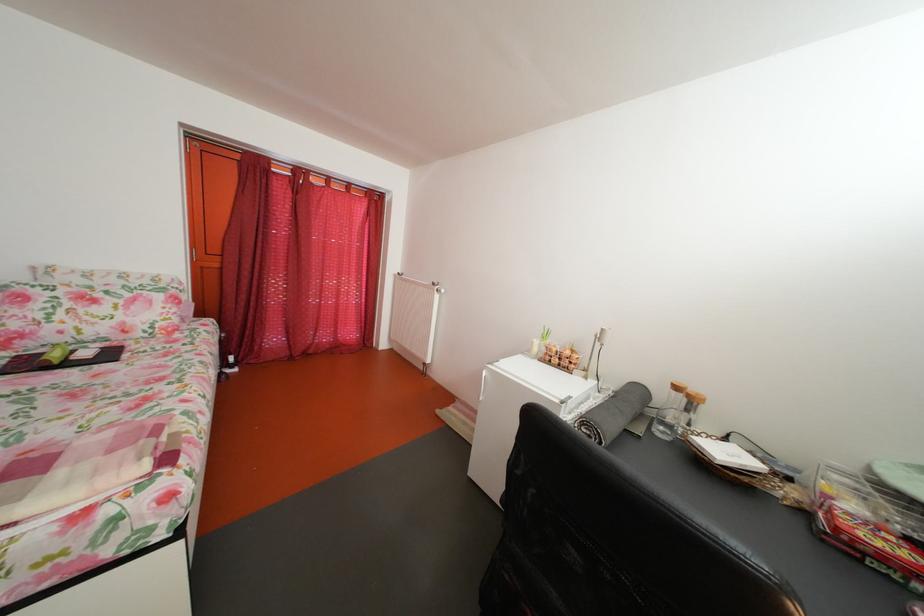
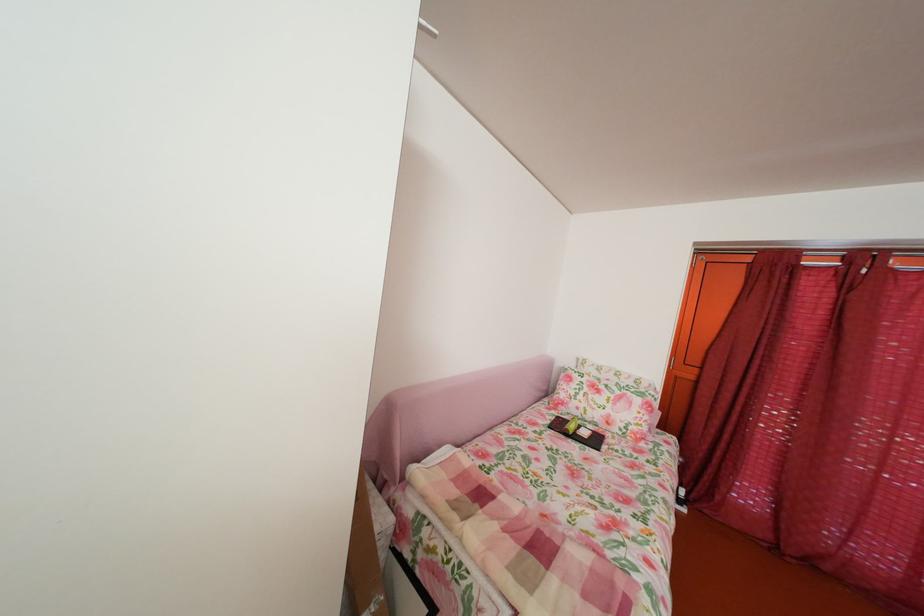
Question: The first image is from the beginning of the video and the second image is from the end. How did the camera likely rotate when shooting the video?

Choices:
 (A) Left
 (B) Right
 (C) Up
 (D) Down

Answer: (A)